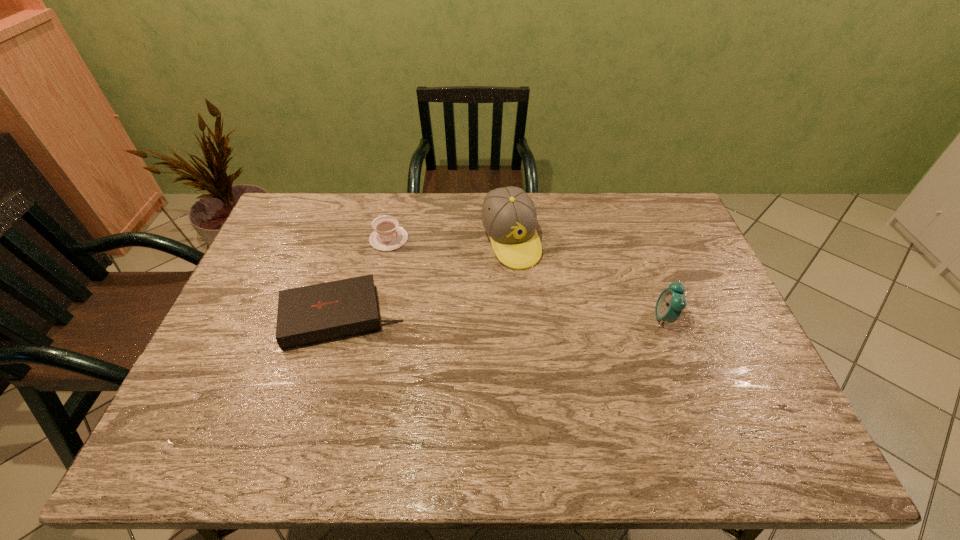
At what (x,y) coordinates should I click in order to perform the action: click on the shortest object. Please return your answer as a coordinate pair (x, y). This screenshot has height=540, width=960. Looking at the image, I should click on (310, 314).

Locate an element on the screen. This screenshot has height=540, width=960. the second tallest object is located at coordinates (671, 301).

At what (x,y) coordinates should I click in order to perform the action: click on alarm clock. Please return your answer as a coordinate pair (x, y). Looking at the image, I should click on (671, 301).

The image size is (960, 540). In order to click on teacup in this screenshot , I will do `click(387, 235)`.

What are the coordinates of `the third object from left to right` in the screenshot? It's located at (509, 217).

Locate an element on the screen. the tallest object is located at coordinates (509, 217).

Identify the location of vacant space located 0.250m on the back of the shortest object. (365, 233).

Where is `blank area located 0.070m on the face of the third shortest object`? blank area located 0.070m on the face of the third shortest object is located at coordinates (629, 318).

Find the location of a particular element. vacant space located 0.200m on the face of the third shortest object is located at coordinates (583, 318).

Locate an element on the screen. The image size is (960, 540). free location located 0.270m on the face of the third shortest object is located at coordinates (559, 318).